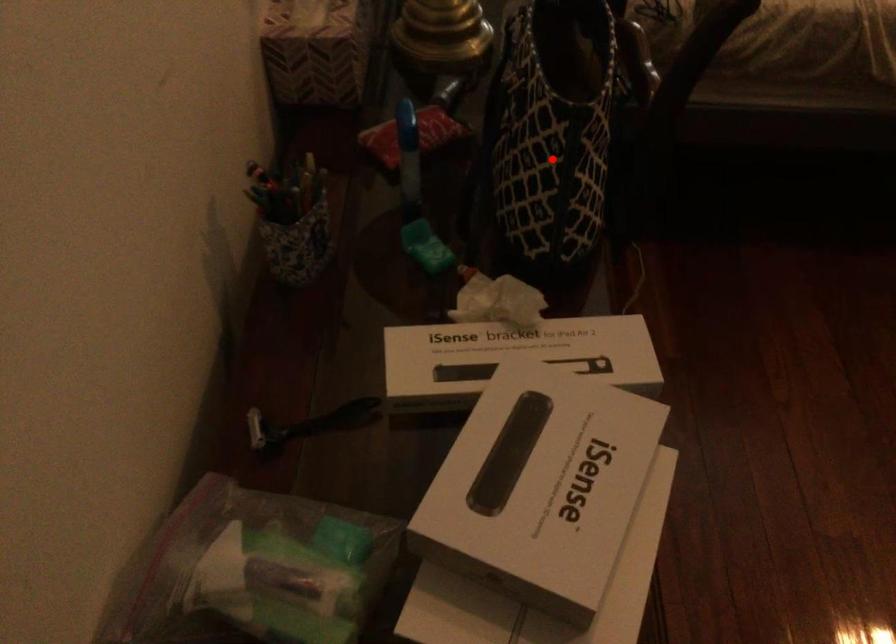
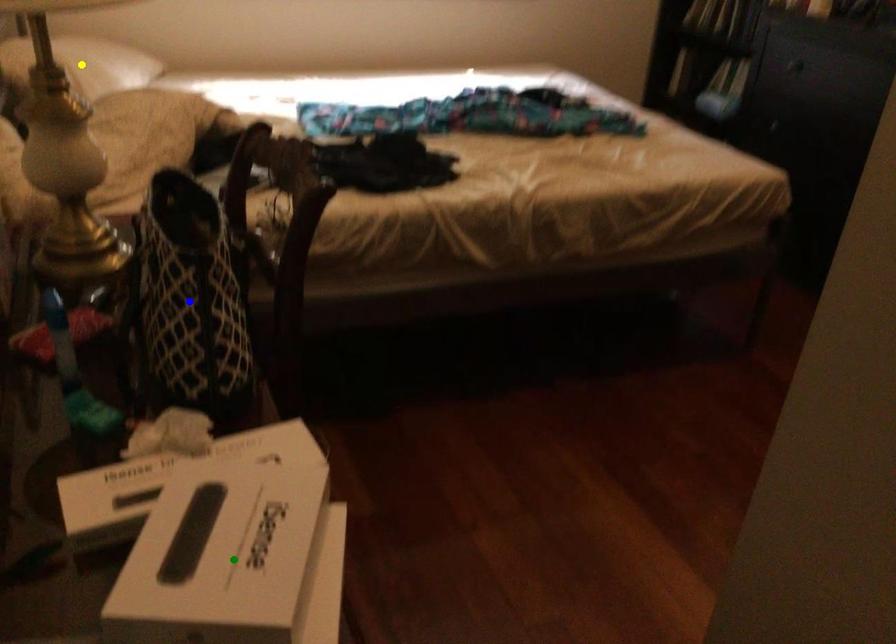
Question: I am providing you with two images of the same scene from different viewpoints. A red point is marked on the first image. You are given multiple points on the second image. Which point in image 2 represents the same 3d spot as the red point in image 1?

Choices:
 (A) yellow point
 (B) green point
 (C) blue point

Answer: (C)